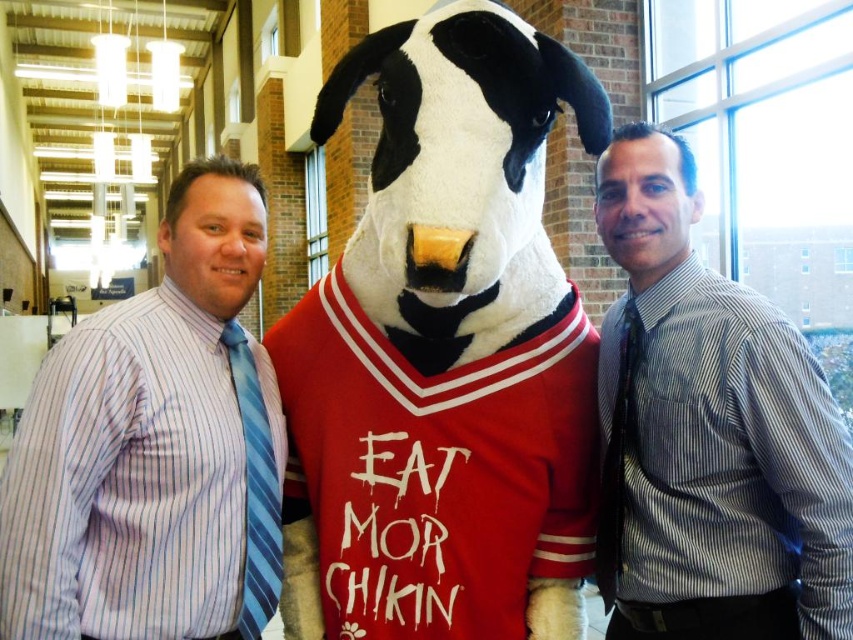
You are a photographer setting up for a group photo. You need to ensure that the white plush dog at center and the black textured tie at right are both visible in the frame. Given their sizes, which object might require you to adjust your camera angle to include it properly?

The white plush dog at center is taller than the black textured tie at right, so you might need to adjust the camera angle to accommodate its height to ensure it fits within the frame.

You are a photographer setting up for a group photo. You notice the blue striped shirt at left and the black textured tie at right in the frame. Which of these two items is positioned higher in the image?

The blue striped shirt at left is positioned higher in the image than the black textured tie at right.